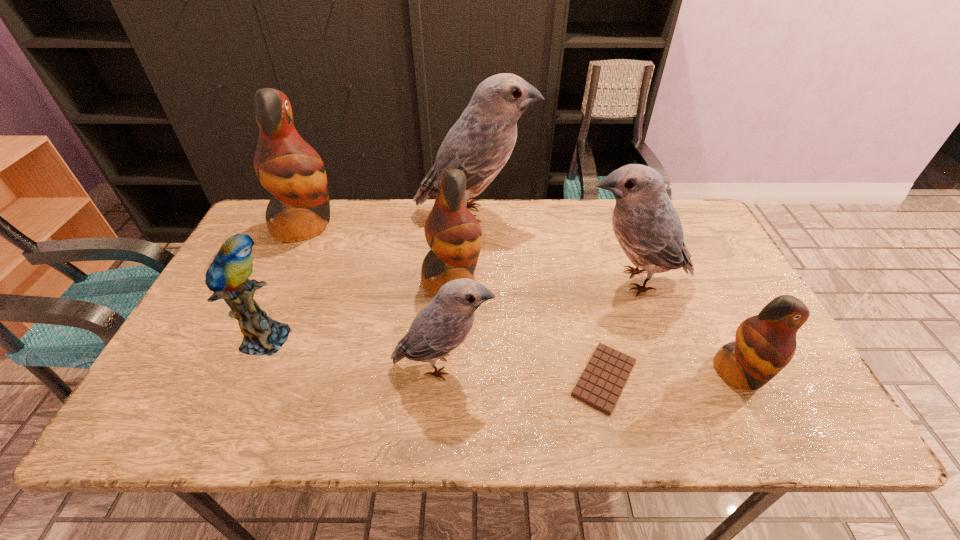
Choose which gray parrot is the third nearest neighbor to the second red parrot from right to left. Please provide its 2D coordinates. Your answer should be formatted as a tuple, i.e. [(x, y)], where the tuple contains the x and y coordinates of a point satisfying the conditions above.

[(648, 228)]

Locate an element on the screen. The width and height of the screenshot is (960, 540). gray parrot that stands as the second closest to the second farthest red parrot is located at coordinates (440, 327).

Choose which red parrot is the nearest neighbor to the second farthest red parrot. Please provide its 2D coordinates. Your answer should be formatted as a tuple, i.e. [(x, y)], where the tuple contains the x and y coordinates of a point satisfying the conditions above.

[(286, 165)]

I want to click on the third closest red parrot to the chocolate bar, so click(286, 165).

Locate an element on the screen. The height and width of the screenshot is (540, 960). vacant region that satisfies the following two spatial constraints: 1. on the face of the chocolate bar; 2. on the left side of the biggest red parrot is located at coordinates (234, 378).

This screenshot has width=960, height=540. I want to click on vacant area that satisfies the following two spatial constraints: 1. on the face of the second farthest red parrot; 2. on the right side of the brown chocolate bar, so click(x=445, y=378).